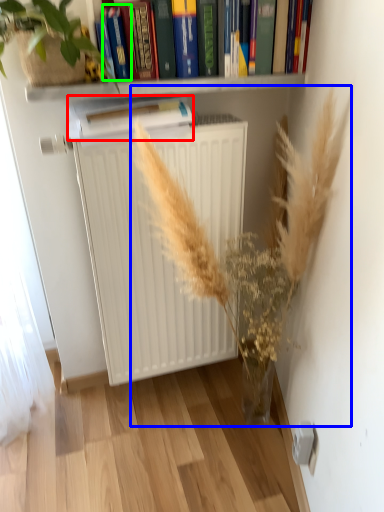
Question: Based on their relative distances, which object is farther from paperback book (highlighted by a red box)? Choose from floral arrangement (highlighted by a blue box) and paperback book (highlighted by a green box).

Choices:
 (A) floral arrangement
 (B) paperback book

Answer: (A)